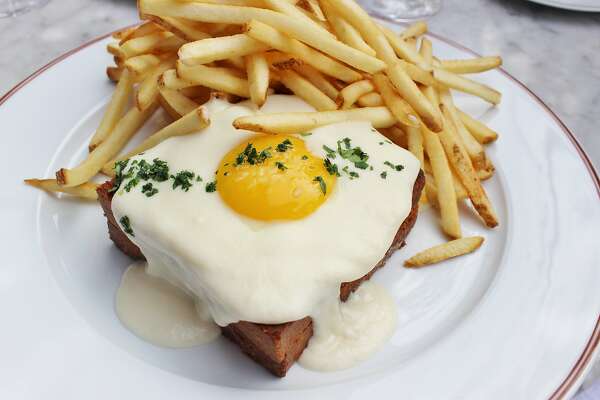
Locate an element on the screen. red lines on edge of white plate is located at coordinates click(555, 119), click(579, 366), click(53, 57).